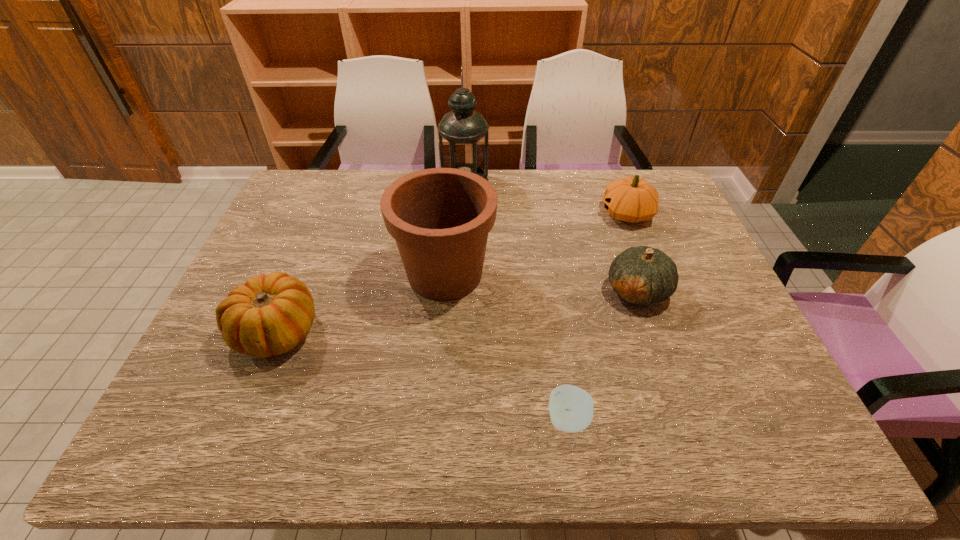
Find the location of a particular element. Image resolution: width=960 pixels, height=540 pixels. the tallest object is located at coordinates (463, 133).

The height and width of the screenshot is (540, 960). In order to click on oil lamp in this screenshot , I will do `click(463, 133)`.

At what (x,y) coordinates should I click in order to perform the action: click on the second tallest object. Please return your answer as a coordinate pair (x, y). Looking at the image, I should click on (440, 218).

Where is `the fifth nearest object`? The width and height of the screenshot is (960, 540). the fifth nearest object is located at coordinates (632, 199).

Locate an element on the screen. This screenshot has height=540, width=960. the leftmost gourd is located at coordinates (271, 314).

Find the location of a particular element. This screenshot has height=540, width=960. the nearest object is located at coordinates (571, 408).

Locate an element on the screen. The width and height of the screenshot is (960, 540). the third object from right to left is located at coordinates (571, 408).

Image resolution: width=960 pixels, height=540 pixels. What are the coordinates of `vacant space located on the right of the farthest object` in the screenshot? It's located at (586, 182).

Identify the location of free space located on the left of the flowerpot. The height and width of the screenshot is (540, 960). (337, 274).

Locate an element on the screen. The height and width of the screenshot is (540, 960). free space located 0.350m on the side of the second farthest object with the carved face is located at coordinates (490, 214).